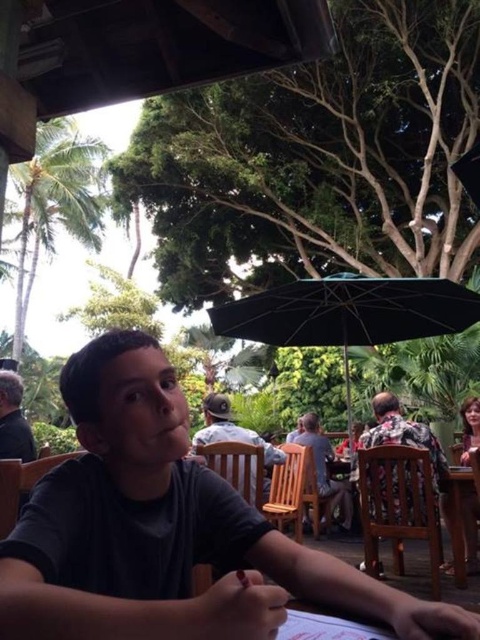
Between wooden table at lower right and dark gray shirt at left, which one is positioned higher?

Positioned higher is dark gray shirt at left.

Can you confirm if wooden table at lower right is smaller than dark gray shirt at left?

Actually, wooden table at lower right might be larger than dark gray shirt at left.

Measure the distance between wooden table at lower right and camera.

wooden table at lower right and camera are 2.77 meters apart from each other.

Image resolution: width=480 pixels, height=640 pixels. Find the location of `wooden table at lower right`. wooden table at lower right is located at coordinates (458, 516).

Which of these two, black matte shirt at center or black fabric umbrella at center, stands shorter?

With less height is black matte shirt at center.

Which is above, black matte shirt at center or black fabric umbrella at center?

black fabric umbrella at center is above.

Which is behind, point (255, 636) or point (220, 321)?

Point (220, 321)

Where is `black matte shirt at center`? black matte shirt at center is located at coordinates (166, 529).

Can you confirm if floral fabric shirt at center is wider than dark gray shirt at left?

Correct, the width of floral fabric shirt at center exceeds that of dark gray shirt at left.

Is point (437, 460) more distant than point (6, 372)?

Yes, point (437, 460) is farther from viewer.

Identify the location of floral fabric shirt at center. The image size is (480, 640). (405, 436).